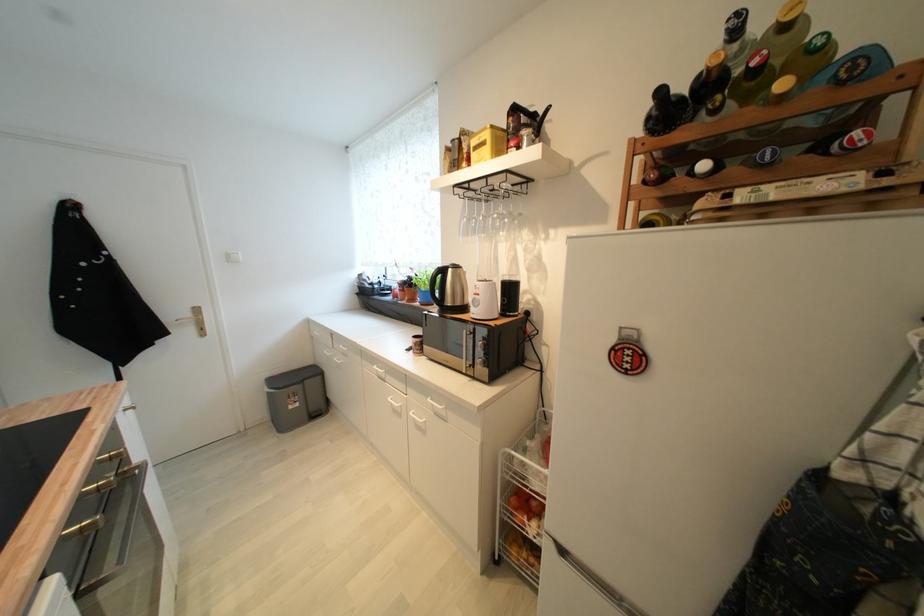
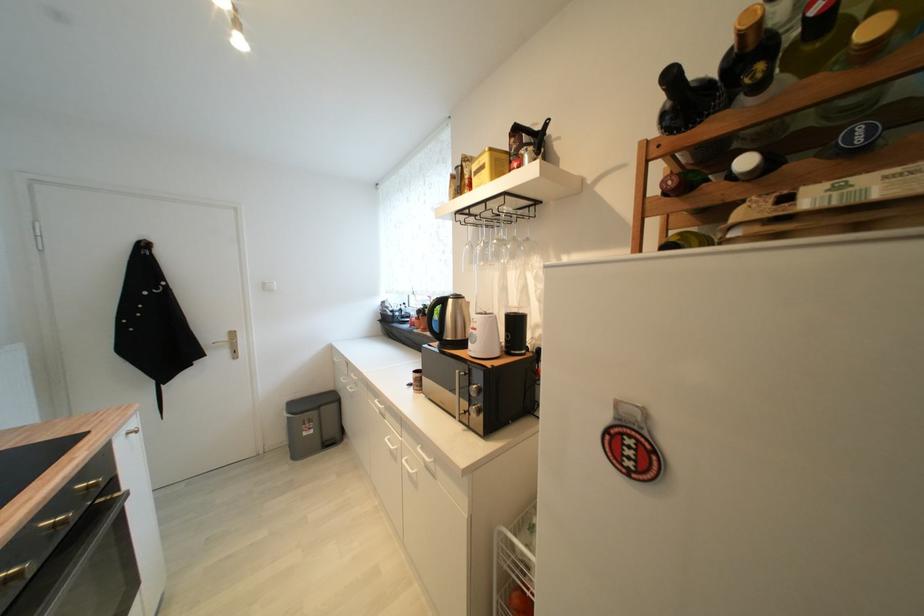
Where in the second image is the point corresponding to (x=650, y=184) from the first image?

(671, 195)